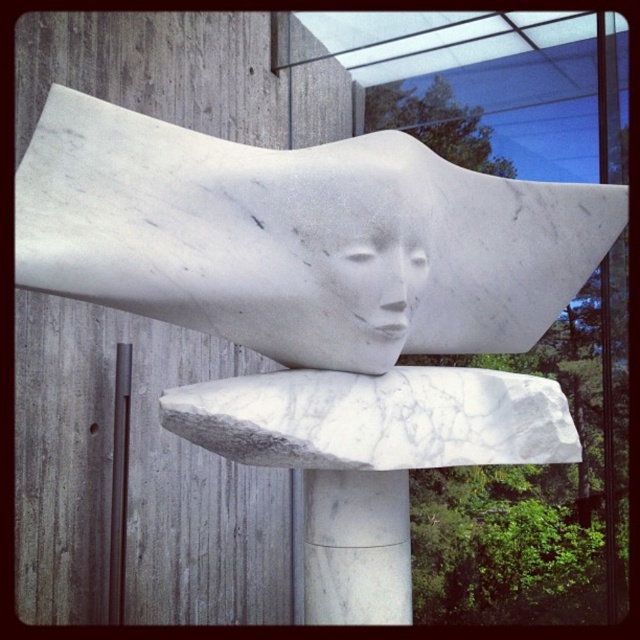
Question: Which point is closer to the camera taking this photo?

Choices:
 (A) (384, 305)
 (B) (385, 157)
 (C) (410, 611)

Answer: (A)

Question: Is white marble pillar at center to the left of white marble face at center from the viewer's perspective?

Choices:
 (A) no
 (B) yes

Answer: (B)

Question: Does white marble sculpture at center have a lesser width compared to white marble pillar at center?

Choices:
 (A) no
 (B) yes

Answer: (A)

Question: Which object is farther from the camera taking this photo?

Choices:
 (A) white marble face at center
 (B) white marble pillar at center
 (C) white marble sculpture at center

Answer: (B)

Question: Is white marble sculpture at center in front of white marble face at center?

Choices:
 (A) yes
 (B) no

Answer: (A)

Question: Estimate the real-world distances between objects in this image. Which object is closer to the white marble sculpture at center?

Choices:
 (A) white marble face at center
 (B) white marble pillar at center

Answer: (A)